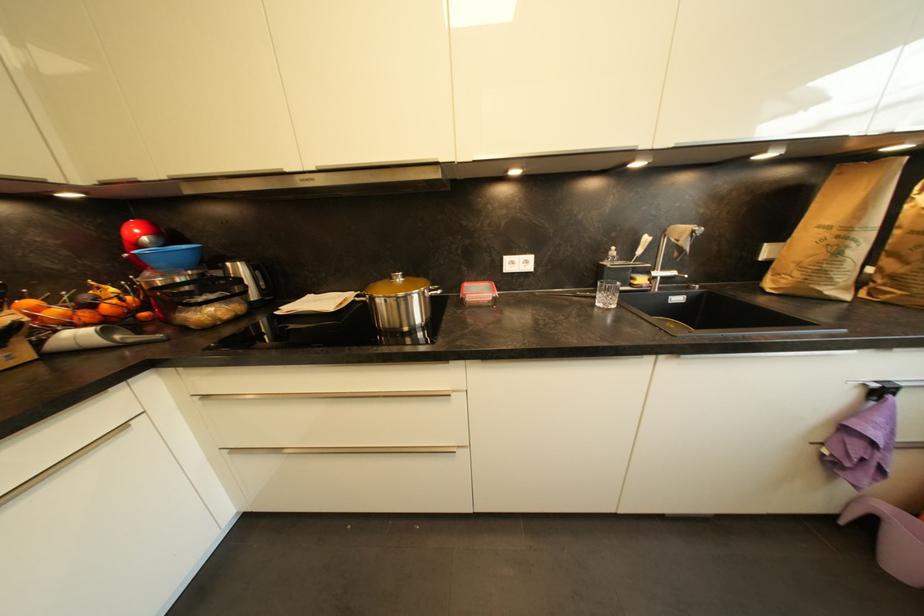
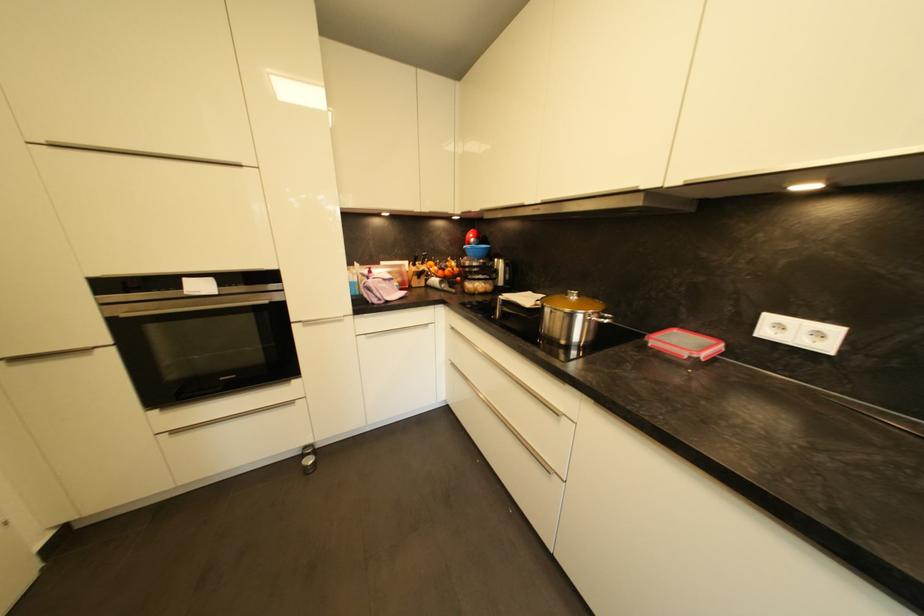
Where in the second image is the point corresponding to point (408, 278) from the first image?

(584, 298)